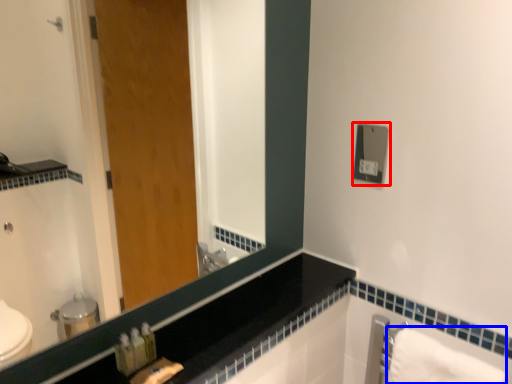
Question: Among these objects, which one is nearest to the camera, electric outlet (highlighted by a red box) or bath towel (highlighted by a blue box)?

Choices:
 (A) electric outlet
 (B) bath towel

Answer: (B)